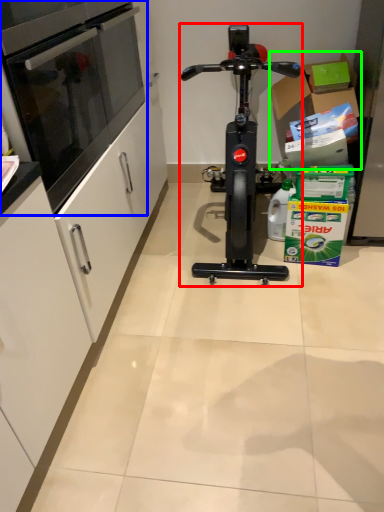
Question: Which object is the farthest from stationary bicycle (highlighted by a red box)? Choose among these: oven (highlighted by a blue box) or cardboard box (highlighted by a green box).

Choices:
 (A) oven
 (B) cardboard box

Answer: (A)